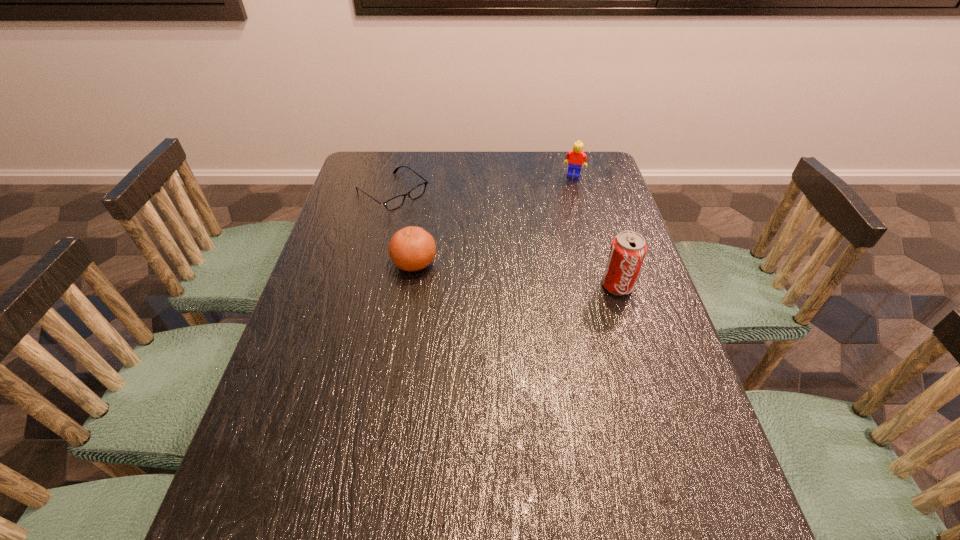
I want to click on free space located 0.050m on the front-facing side of the shortest object, so tap(425, 215).

At what (x,y) coordinates should I click in order to perform the action: click on vacant space located 0.140m on the front-facing side of the shortest object. Please return your answer as a coordinate pair (x, y). Looking at the image, I should click on (444, 228).

Where is `Lego that is positioned at the far edge`? Image resolution: width=960 pixels, height=540 pixels. Lego that is positioned at the far edge is located at coordinates (576, 157).

Identify the location of spectacles that is at the far edge. (397, 201).

Locate an element on the screen. object that is at the left edge is located at coordinates (397, 201).

Where is `soda can that is at the right edge`? This screenshot has width=960, height=540. soda can that is at the right edge is located at coordinates [628, 249].

This screenshot has width=960, height=540. In order to click on Lego at the right edge in this screenshot , I will do `click(576, 157)`.

Identify the location of object positioned at the far left corner. (397, 201).

In order to click on object at the far right corner in this screenshot , I will do `click(576, 157)`.

Identify the location of free space at the far edge of the desktop. 465,157.